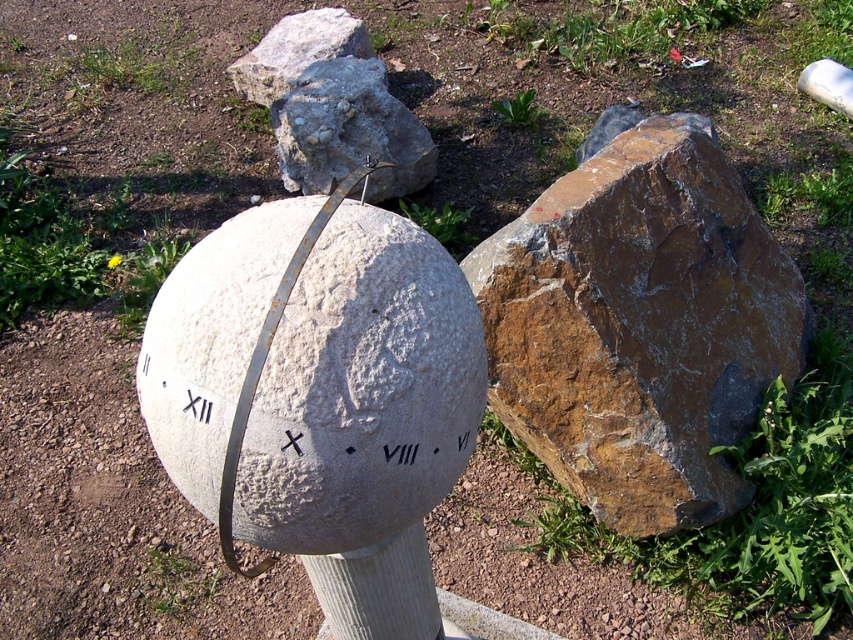
Question: Which is farther from the rusty metallic boulder at right?

Choices:
 (A) gray rough rock at upper center
 (B) gray rough stone boulder at center

Answer: (A)

Question: Based on their relative distances, which object is nearer to the white stone sphere at center?

Choices:
 (A) rusty metallic boulder at right
 (B) gray rough rock at upper center
 (C) gray rough stone boulder at center

Answer: (A)

Question: Does white stone sphere at center appear on the right side of gray rough stone boulder at center?

Choices:
 (A) no
 (B) yes

Answer: (B)

Question: Which point is farther from the camera taking this photo?

Choices:
 (A) (712, 232)
 (B) (357, 291)

Answer: (A)

Question: Does white stone sphere at center appear over gray rough rock at upper center?

Choices:
 (A) yes
 (B) no

Answer: (B)

Question: Can you confirm if rusty metallic boulder at right is thinner than gray rough rock at upper center?

Choices:
 (A) yes
 (B) no

Answer: (B)